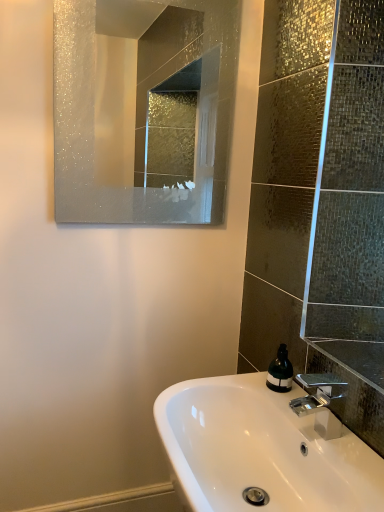
Question: Should I look upward or downward to see frosted glass mirror at upper center?

Choices:
 (A) down
 (B) up

Answer: (B)

Question: From a real-world perspective, is green matte soap dispenser at lower right physically above polished chrome faucet at lower right?

Choices:
 (A) no
 (B) yes

Answer: (A)

Question: Is green matte soap dispenser at lower right aimed at polished chrome faucet at lower right?

Choices:
 (A) no
 (B) yes

Answer: (A)

Question: Considering the relative sizes of green matte soap dispenser at lower right and polished chrome faucet at lower right in the image provided, is green matte soap dispenser at lower right smaller than polished chrome faucet at lower right?

Choices:
 (A) no
 (B) yes

Answer: (B)

Question: Can you confirm if green matte soap dispenser at lower right is shorter than polished chrome faucet at lower right?

Choices:
 (A) no
 (B) yes

Answer: (B)

Question: Is green matte soap dispenser at lower right to the right of polished chrome faucet at lower right from the viewer's perspective?

Choices:
 (A) no
 (B) yes

Answer: (A)

Question: Is green matte soap dispenser at lower right bigger than polished chrome faucet at lower right?

Choices:
 (A) no
 (B) yes

Answer: (A)

Question: Can you confirm if frosted glass mirror at upper center is bigger than white glossy sink at lower center?

Choices:
 (A) no
 (B) yes

Answer: (A)

Question: Is frosted glass mirror at upper center positioned in front of white glossy sink at lower center?

Choices:
 (A) no
 (B) yes

Answer: (A)

Question: Is the position of frosted glass mirror at upper center more distant than that of white glossy sink at lower center?

Choices:
 (A) yes
 (B) no

Answer: (A)

Question: Is frosted glass mirror at upper center shorter than white glossy sink at lower center?

Choices:
 (A) no
 (B) yes

Answer: (A)

Question: Is white glossy sink at lower center surrounded by frosted glass mirror at upper center?

Choices:
 (A) yes
 (B) no

Answer: (B)

Question: Is frosted glass mirror at upper center completely or partially outside of white glossy sink at lower center?

Choices:
 (A) yes
 (B) no

Answer: (A)

Question: Can you confirm if white glossy sink at lower center is positioned to the right of frosted glass mirror at upper center?

Choices:
 (A) yes
 (B) no

Answer: (A)